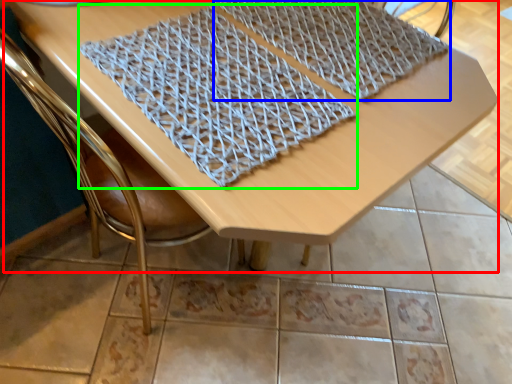
Question: Estimate the real-world distances between objects in this image. Which object is closer to table (highlighted by a red box), blanket (highlighted by a blue box) or blanket (highlighted by a green box)?

Choices:
 (A) blanket
 (B) blanket

Answer: (B)